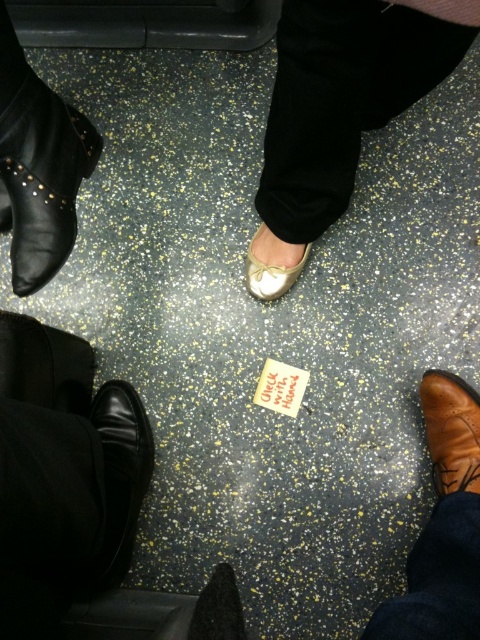
Question: Is matte gold shoe at center to the right of shiny black shoe at center from the viewer's perspective?

Choices:
 (A) yes
 (B) no

Answer: (A)

Question: Which object is the farthest from the shiny black shoe at lower left?

Choices:
 (A) white leather shoe at center
 (B) black leather boot at left
 (C) brown leather boot at lower right

Answer: (C)

Question: Is brown leather boot at lower right behind white leather shoe at center?

Choices:
 (A) yes
 (B) no

Answer: (B)

Question: Which object is closer to the camera taking this photo?

Choices:
 (A) black leather boot at left
 (B) white leather shoe at center
 (C) shiny black shoe at center

Answer: (A)

Question: Among these objects, which one is farthest from the camera?

Choices:
 (A) black leather boot at left
 (B) white leather shoe at center
 (C) brown leather boot at lower right

Answer: (B)

Question: Is matte gold shoe at center positioned behind shiny black shoe at center?

Choices:
 (A) no
 (B) yes

Answer: (A)